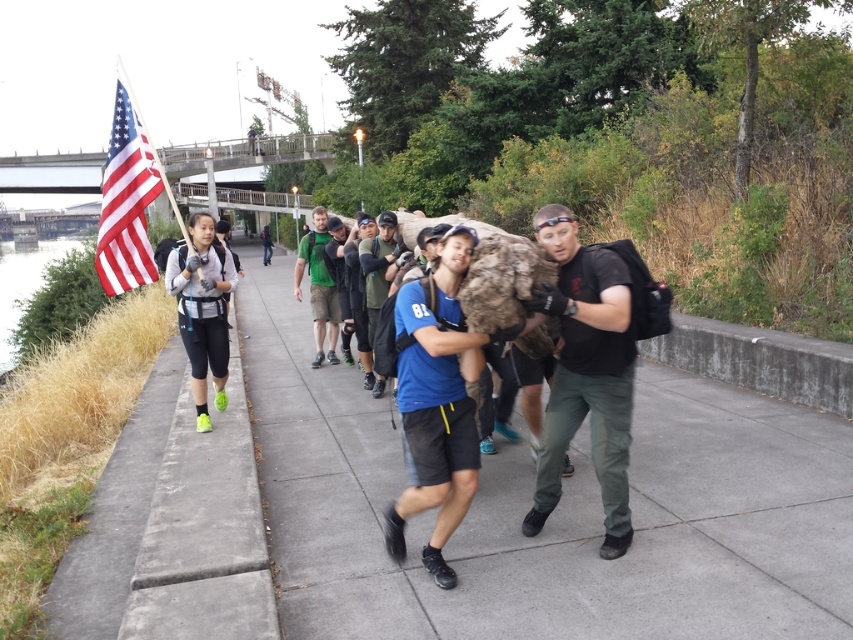
You are a photographer trying to capture the entire scene of the concrete sidewalk at center and the black matte shirt at center in one shot. Given that your camera has a fixed focal length, which object should you focus on first to ensure both are in frame?

The concrete sidewalk at center is bigger than the black matte shirt at center, so you should focus on the concrete sidewalk at center first to ensure both are in frame.